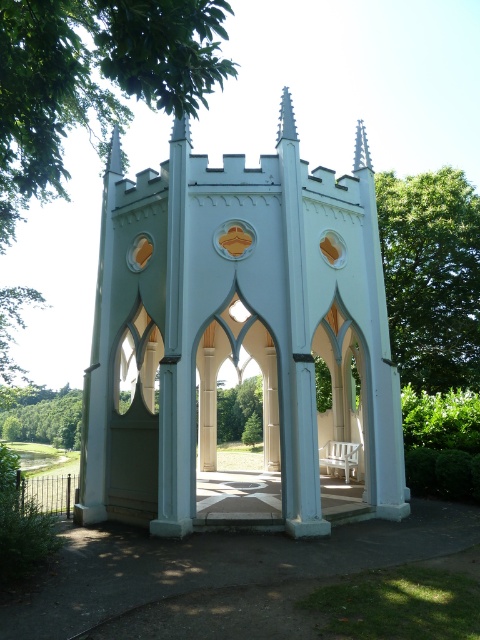
You are standing in a park and see a light pastel blue Gothic pavilion with pointed arches. There is a point marked at coordinates (239,332). According to the image, what object is located at that point?

The point at coordinates (239,332) corresponds to the white smooth gazebo at center.

You are standing in a park and want to take a photo of the white smooth gazebo at center and the green leafy tree at upper center. Which object will appear closer to you in the photo?

The white smooth gazebo at center will appear closer to you in the photo because it is positioned further to the viewer than the green leafy tree at upper center.